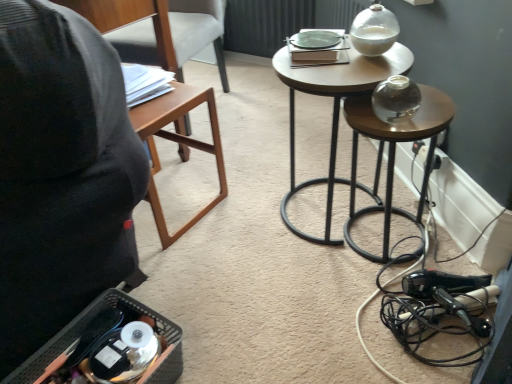
Question: Relative to transparent glass vase at center right, positioned as the second stool in left-to-right order, is brown wood table at left in front or behind?

Choices:
 (A) front
 (B) behind

Answer: (B)

Question: Based on their sizes in the image, would you say brown wood table at left is bigger or smaller than transparent glass vase at center right, the first stool in the right-to-left sequence?

Choices:
 (A) big
 (B) small

Answer: (A)

Question: Estimate the real-world distances between objects in this image. Which object is farther from the brown wood table at left?

Choices:
 (A) wooden chair at left
 (B) white plastic electric outlet at lower right
 (C) transparent glass vase at center right, positioned as the second stool in left-to-right order
 (D) wooden glossy stool at upper center, which ranks as the first stool in left-to-right order

Answer: (B)

Question: Which object is positioned closest to the brown wood table at left?

Choices:
 (A) white plastic electric outlet at lower right
 (B) transparent glass vase at center right, the first stool in the right-to-left sequence
 (C) wooden glossy stool at upper center, positioned as the 2th stool in right-to-left order
 (D) wooden chair at left

Answer: (C)